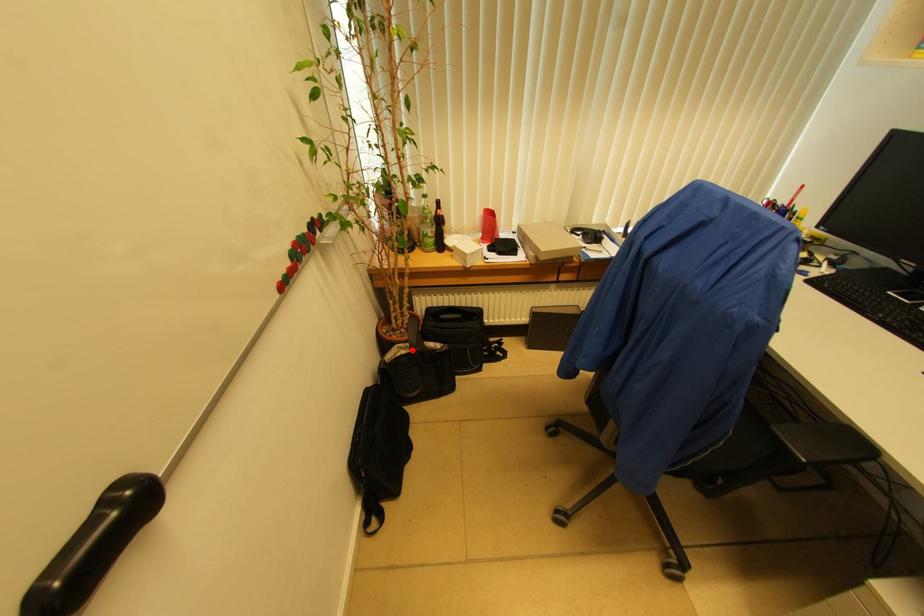
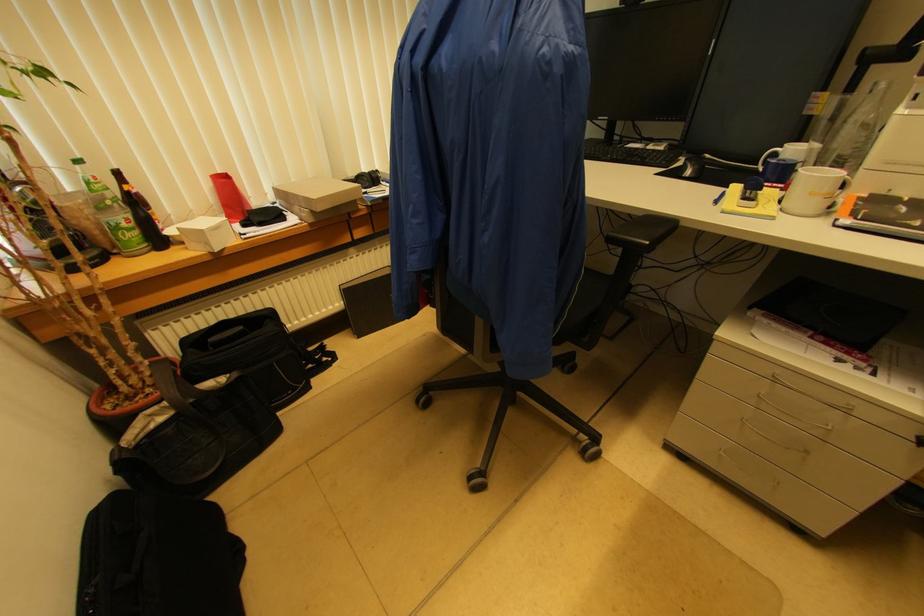
Question: I am providing you with two images of the same scene from different viewpoints. Given a red point in image1, look at the same physical point in image2. Is it:

Choices:
 (A) Closer to the viewpoint
 (B) Farther from the viewpoint

Answer: (A)